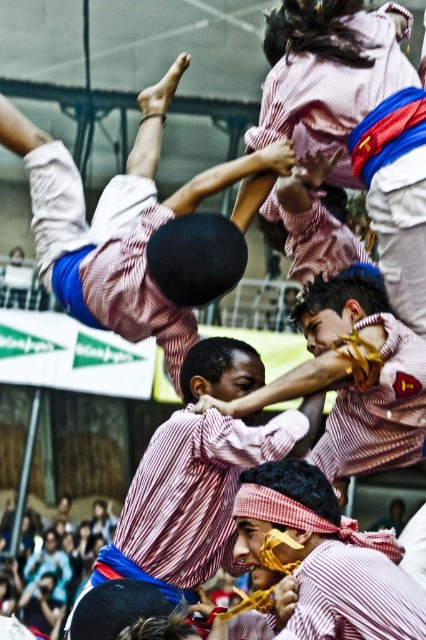
You are a photographer in the sports hall and want to capture a photo of the striped fabric shirt at center and the striped fabric man at center. Which one should you focus on to ensure it appears larger in the photo?

The striped fabric shirt at center is taller than the striped fabric man at center, so focusing on the striped fabric shirt at center will make it appear larger in the photo.

You are a photographer positioned at the front of the indoor arena where the performance is taking place. You want to capture a photo that includes both the point at position (198, 483) and the point at (351, 396). Since you want the subject closer to the camera to be in focus, which point should you focus on?

You should focus on point (198, 483) because it is closer to the camera than point (351, 396), ensuring it remains in focus while the other point may be slightly out of focus.

In the image of the cultural performance, there are two participants wearing striped fabric clothing. One is labeled as the striped fabric dancer at upper center and the other as the striped fabric shirt at center. From the perspective of someone watching the performance from the audience, which participant is positioned to the right side?

The striped fabric dancer at upper center is positioned to the right of the striped fabric shirt at center.